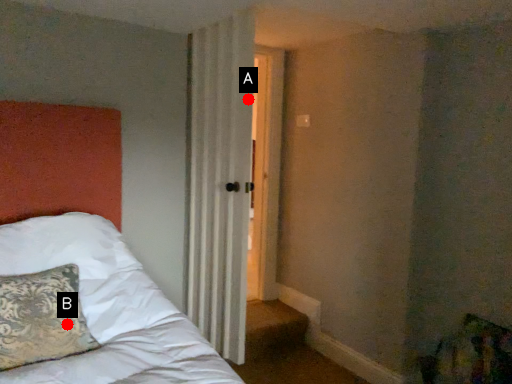
Question: Two points are circled on the image, labeled by A and B beside each circle. Which of the following is the closest to the observer?

Choices:
 (A) A is closer
 (B) B is closer

Answer: (B)